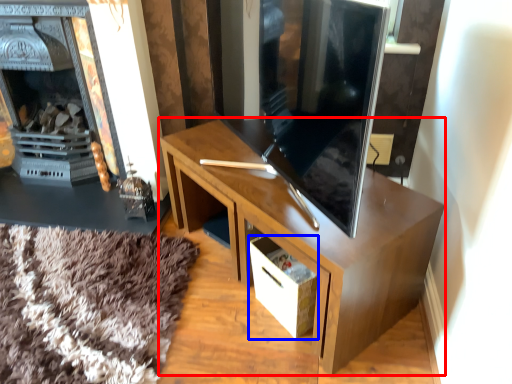
Question: Which object is closer to the camera taking this photo, desk (highlighted by a red box) or drawer (highlighted by a blue box)?

Choices:
 (A) desk
 (B) drawer

Answer: (A)